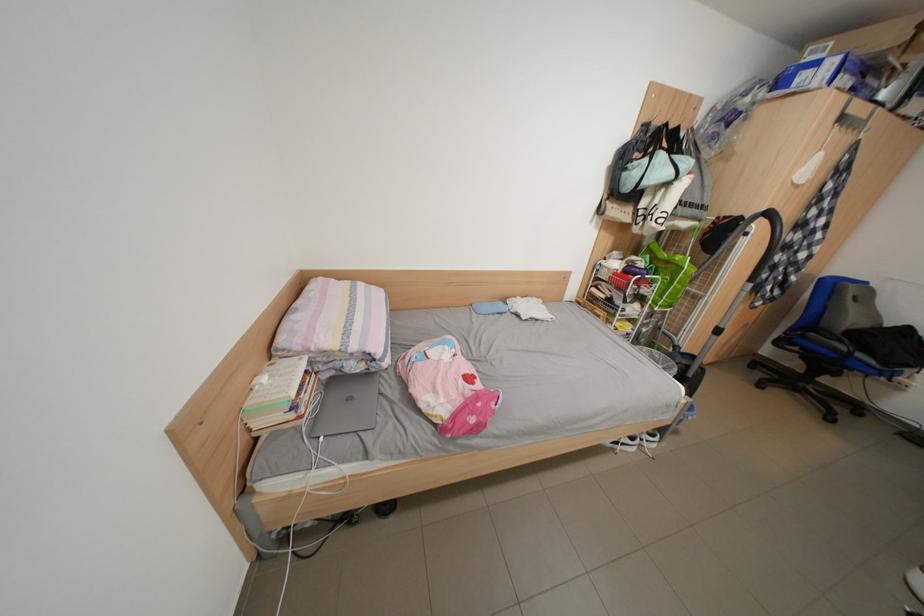
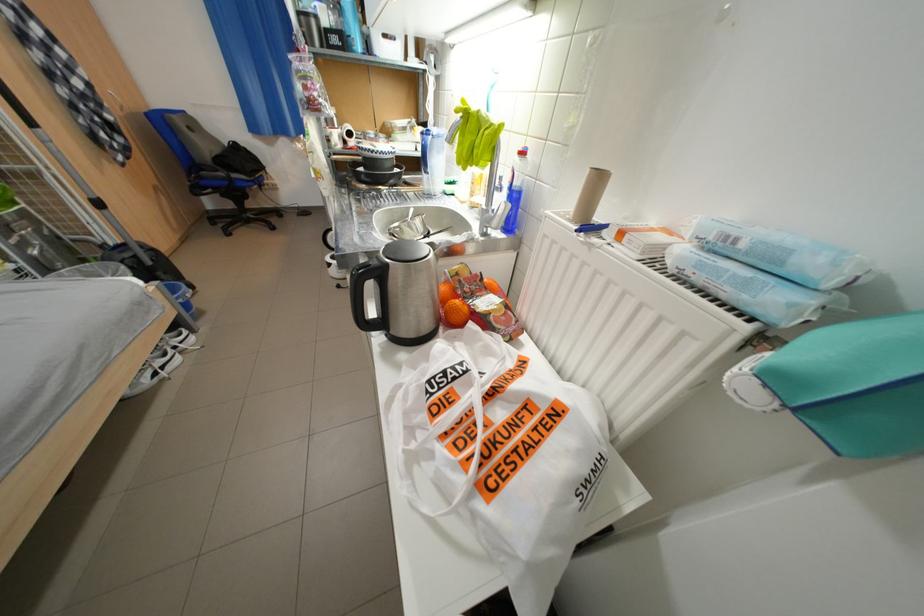
Based on the continuous images, in which direction is the camera rotating?

The rotation direction of the camera is right-down.